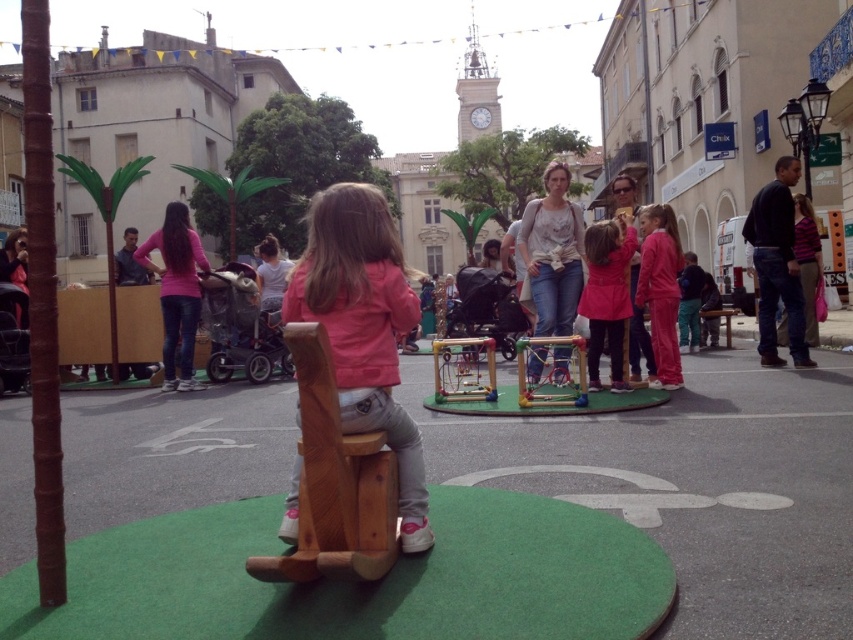
Question: Observing the image, what is the correct spatial positioning of matte pink jacket at center in reference to metallic silver frame at center?

Choices:
 (A) right
 (B) left

Answer: (B)

Question: Which object is positioned farthest from the matte pink jacket at center?

Choices:
 (A) metallic yellow swing at center
 (B) metallic silver frame at center
 (C) matte pink coat at center
 (D) wooden at center

Answer: (C)

Question: Which object is positioned closest to the metallic yellow swing at center?

Choices:
 (A) wooden at center
 (B) matte pink jacket at center
 (C) matte pink coat at center

Answer: (C)

Question: Is matte pink coat at center in front of metallic yellow swing at center?

Choices:
 (A) yes
 (B) no

Answer: (B)

Question: Does matte pink jacket at center have a greater width compared to metallic yellow swing at center?

Choices:
 (A) no
 (B) yes

Answer: (B)

Question: Which is farther from the wooden at center?

Choices:
 (A) metallic yellow swing at center
 (B) matte pink jacket at center
 (C) matte pink coat at center

Answer: (C)